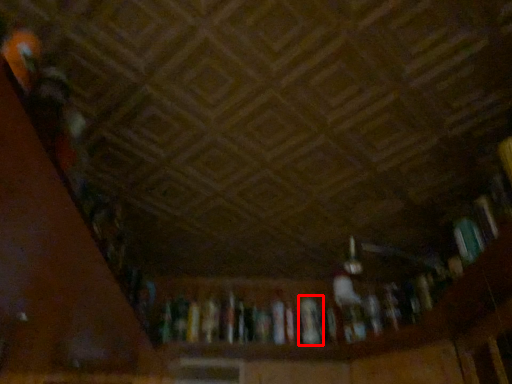
Question: Considering the relative positions of book (annotated by the red box) and book in the image provided, where is book (annotated by the red box) located with respect to the staircase?

Choices:
 (A) left
 (B) right

Answer: (A)